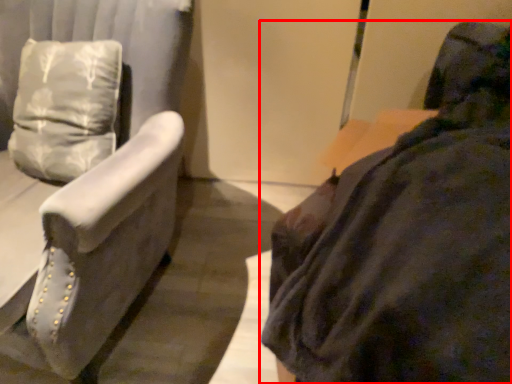
Question: From the image's perspective, what is the correct spatial relationship of furniture (annotated by the red box) in relation to furniture?

Choices:
 (A) below
 (B) above

Answer: (A)